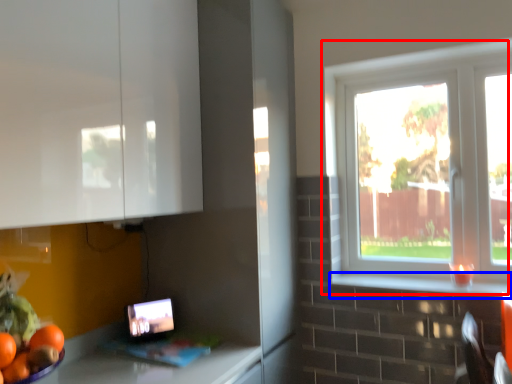
Question: Which point is further to the camera, window (highlighted by a red box) or window sill (highlighted by a blue box)?

Choices:
 (A) window
 (B) window sill

Answer: (A)